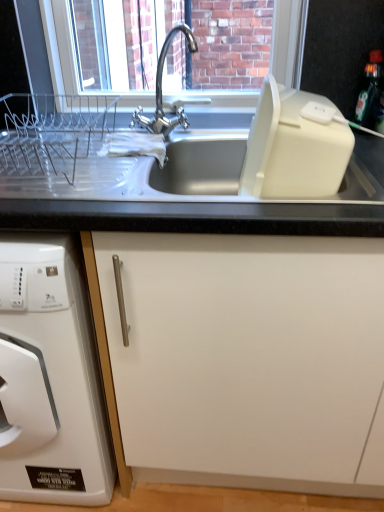
Question: From the image's perspective, is black glossy bottle at upper right under white plastic dish rack at left?

Choices:
 (A) no
 (B) yes

Answer: (A)

Question: Is there a large distance between black glossy bottle at upper right and white plastic dish rack at left?

Choices:
 (A) yes
 (B) no

Answer: (A)

Question: Does black glossy bottle at upper right have a lesser height compared to white plastic dish rack at left?

Choices:
 (A) no
 (B) yes

Answer: (B)

Question: Does black glossy bottle at upper right have a greater width compared to white plastic dish rack at left?

Choices:
 (A) no
 (B) yes

Answer: (A)

Question: From a real-world perspective, does black glossy bottle at upper right stand above white plastic dish rack at left?

Choices:
 (A) yes
 (B) no

Answer: (A)

Question: Is black glossy bottle at upper right to the left or to the right of clear glass window screen at upper center in the image?

Choices:
 (A) left
 (B) right

Answer: (B)

Question: In terms of size, does black glossy bottle at upper right appear bigger or smaller than clear glass window screen at upper center?

Choices:
 (A) big
 (B) small

Answer: (B)

Question: Does point (370, 61) appear closer or farther from the camera than point (51, 33)?

Choices:
 (A) closer
 (B) farther

Answer: (A)

Question: Do you think black glossy bottle at upper right is within clear glass window screen at upper center, or outside of it?

Choices:
 (A) outside
 (B) inside

Answer: (A)

Question: From the image's perspective, is black glossy bottle at upper right above or below white plastic dish rack at left?

Choices:
 (A) above
 (B) below

Answer: (A)

Question: In terms of width, does black glossy bottle at upper right look wider or thinner when compared to white plastic dish rack at left?

Choices:
 (A) wide
 (B) thin

Answer: (B)

Question: Is point (364, 119) closer or farther from the camera than point (61, 344)?

Choices:
 (A) farther
 (B) closer

Answer: (A)

Question: In the image, is black glossy bottle at upper right on the left side or the right side of white plastic dish rack at left?

Choices:
 (A) left
 (B) right

Answer: (B)

Question: Considering the positions of white plastic dish rack at left and black glossy bottle at upper right in the image, is white plastic dish rack at left bigger or smaller than black glossy bottle at upper right?

Choices:
 (A) small
 (B) big

Answer: (B)

Question: From a real-world perspective, is white plastic dish rack at left physically located above or below black glossy bottle at upper right?

Choices:
 (A) above
 (B) below

Answer: (B)